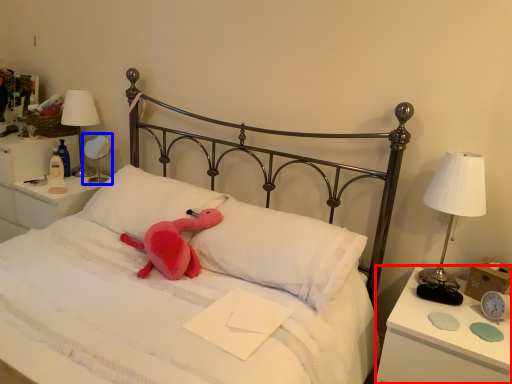
Question: Which object appears closest to the camera in this image, nightstand (highlighted by a red box) or bedside lamp (highlighted by a blue box)?

Choices:
 (A) nightstand
 (B) bedside lamp

Answer: (A)